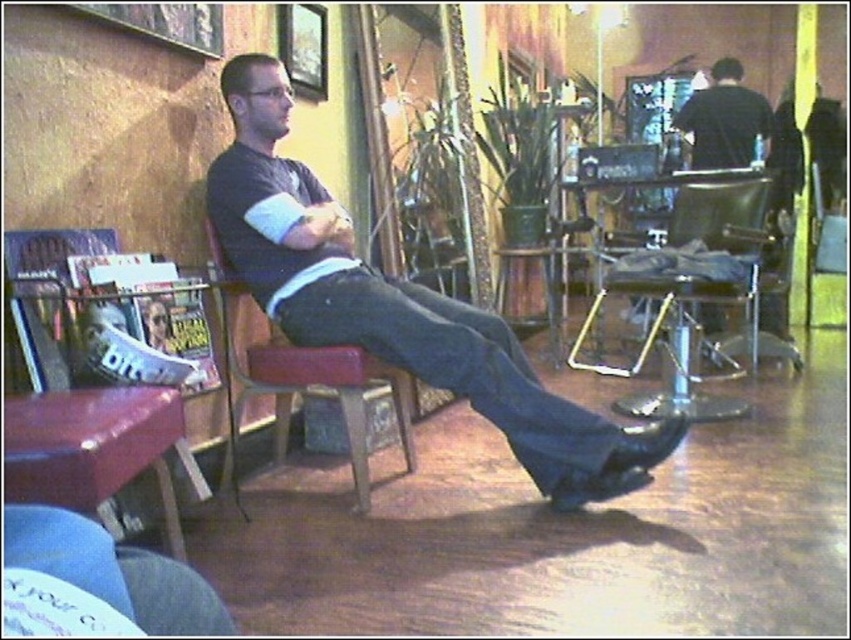
Question: Estimate the real-world distances between objects in this image. Which object is farther from the matte black shirt at center?

Choices:
 (A) denim jeans at lower left
 (B) black leather chair at center

Answer: (A)

Question: Observing the image, what is the correct spatial positioning of leather armchair at center in reference to shiny metallic shoe at lower center?

Choices:
 (A) left
 (B) right

Answer: (A)

Question: Can you confirm if matte black shirt at center is smaller than black leather chair at center?

Choices:
 (A) yes
 (B) no

Answer: (A)

Question: Which object appears farthest from the camera in this image?

Choices:
 (A) leather armchair at center
 (B) leather bar stool at lower left

Answer: (A)

Question: Where is matte black shirt at center located in relation to denim jeans at lower left in the image?

Choices:
 (A) left
 (B) right

Answer: (B)

Question: Which point is closer to the camera?

Choices:
 (A) (75, 492)
 (B) (757, 115)

Answer: (A)